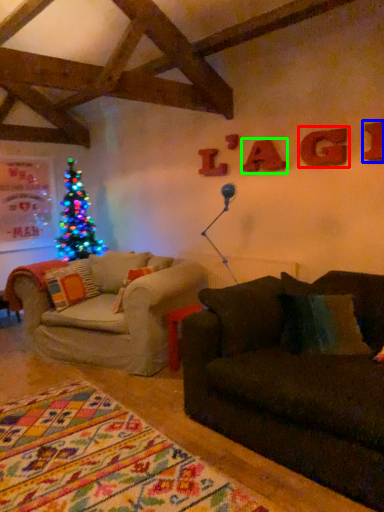
Question: Considering the real-world distances, which object is farthest from letter (highlighted by a red box)? letter (highlighted by a blue box) or letter (highlighted by a green box)?

Choices:
 (A) letter
 (B) letter

Answer: (B)